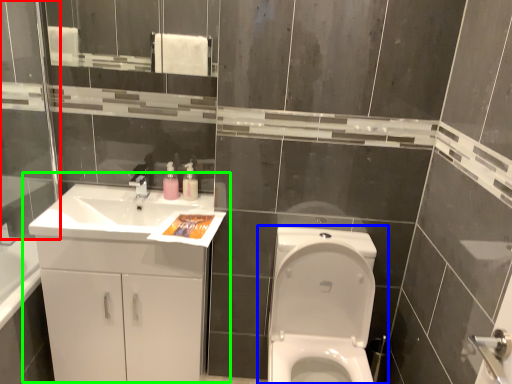
Question: Considering the real-world distances, which object is farthest from glass door (highlighted by a red box)? toilet (highlighted by a blue box) or bathroom cabinet (highlighted by a green box)?

Choices:
 (A) toilet
 (B) bathroom cabinet

Answer: (A)